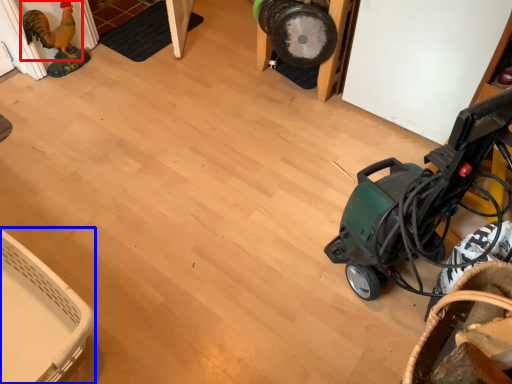
Question: Among these objects, which one is nearest to the camera, chicken (highlighted by a red box) or basket (highlighted by a blue box)?

Choices:
 (A) chicken
 (B) basket

Answer: (B)